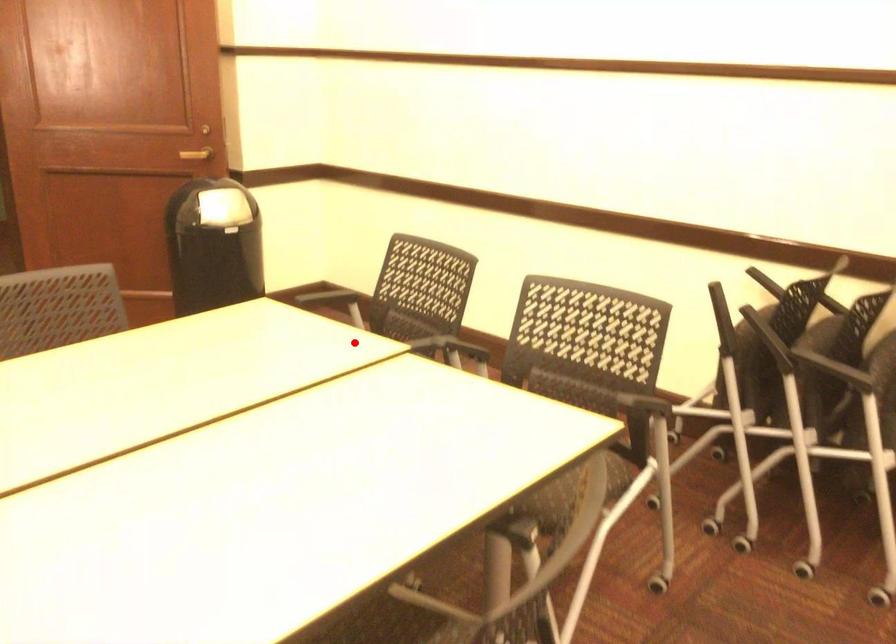
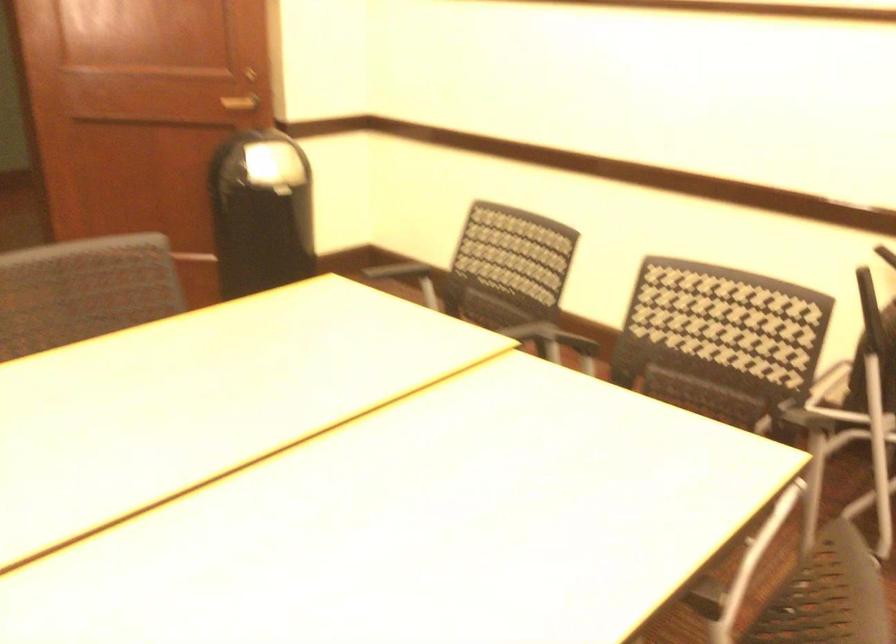
Find the pixel in the second image that matches the highlighted location in the first image.

(446, 332)